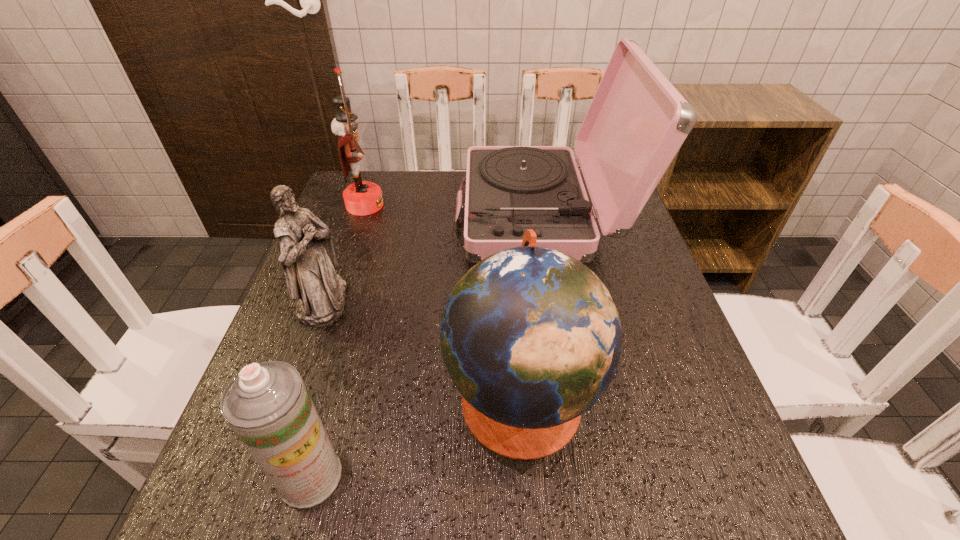
This screenshot has height=540, width=960. Find the location of `record player`. record player is located at coordinates (637, 121).

Locate an element on the screen. The height and width of the screenshot is (540, 960). nutcracker is located at coordinates (361, 198).

Where is `globe`? globe is located at coordinates (531, 338).

The width and height of the screenshot is (960, 540). Find the location of `the third farthest object`. the third farthest object is located at coordinates (308, 259).

Identify the location of aerosol can. (x=267, y=405).

Identify the location of free region located with the lid open on the record player. (348, 215).

Locate an element on the screen. This screenshot has width=960, height=540. blank area located with the lid open on the record player is located at coordinates point(435,215).

Locate an element on the screen. The height and width of the screenshot is (540, 960). free space located 0.160m with the lid open on the record player is located at coordinates (398, 215).

Identify the location of free space located on the front-facing side of the nutcracker. This screenshot has width=960, height=540. (436, 205).

Find the location of a particular element. The image size is (960, 540). vacant space located with the Americas facing the viewer on the globe is located at coordinates (409, 396).